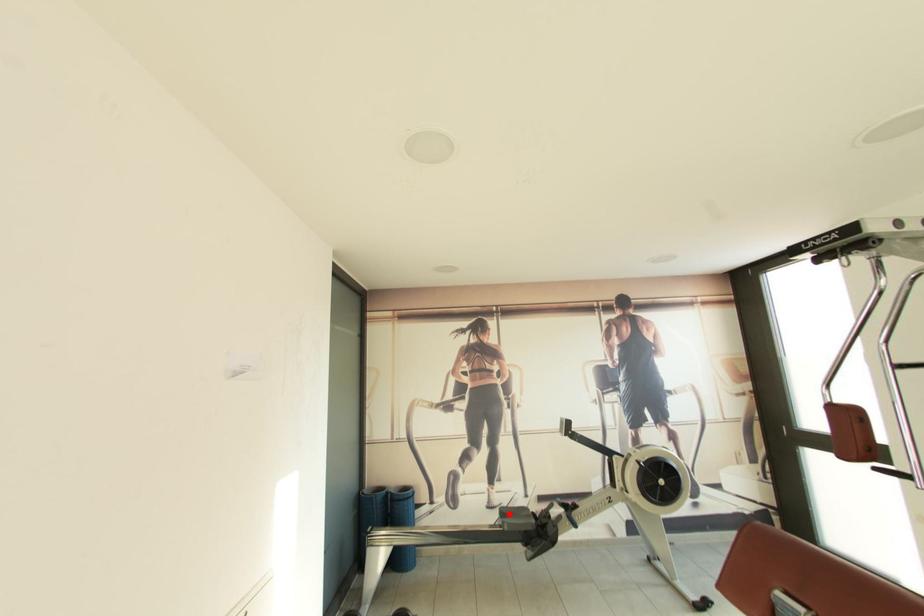
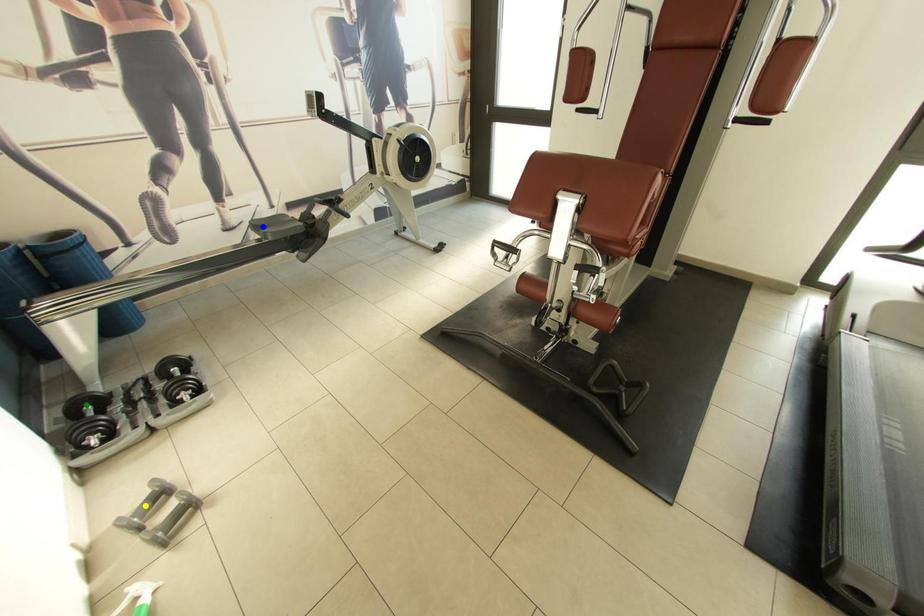
Question: I am providing you with two images of the same scene from different viewpoints. A red point is marked on the first image. You are given multiple points on the second image. Which spot in image 2 lines up with the point in image 1?

Choices:
 (A) green point
 (B) yellow point
 (C) blue point

Answer: (C)